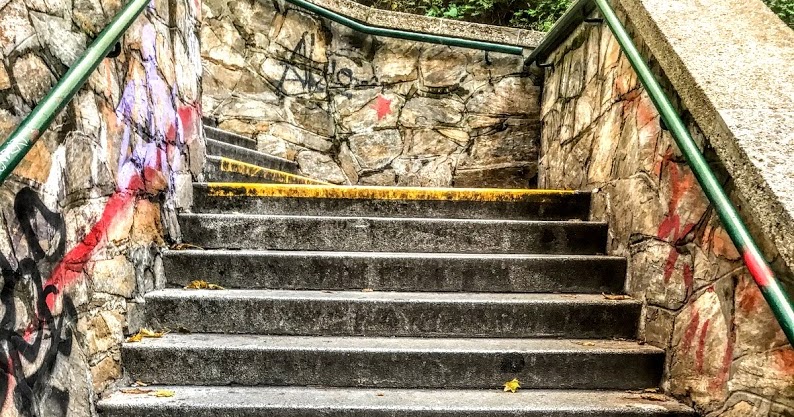
Where is `stairs`? stairs is located at coordinates (333, 399), (342, 351), (353, 298), (360, 259), (361, 224), (361, 190), (255, 169), (236, 151), (229, 135).